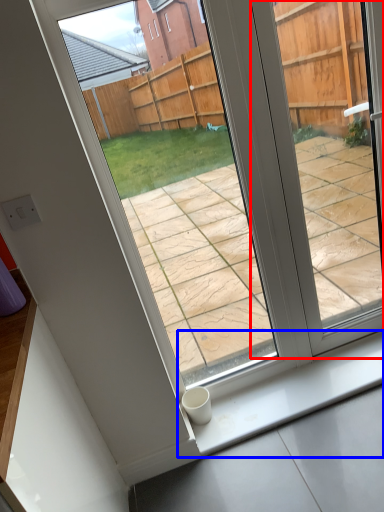
Question: Which point is further to the camera, window (highlighted by a red box) or window sill (highlighted by a blue box)?

Choices:
 (A) window
 (B) window sill

Answer: (B)